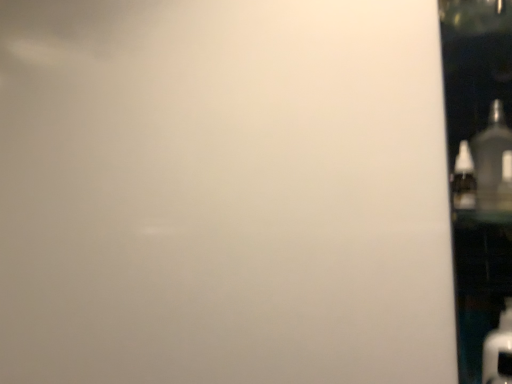
What do you see at coordinates (480, 181) in the screenshot? The image size is (512, 384). I see `transparent glass door at right` at bounding box center [480, 181].

The height and width of the screenshot is (384, 512). What are the coordinates of `transparent glass door at right` in the screenshot? It's located at (480, 181).

Is clear plastic bottle at right, which is counted as the 2th bottle, starting from the right, aimed at transparent glass door at right?

Yes, clear plastic bottle at right, which is counted as the 2th bottle, starting from the right, is facing transparent glass door at right.

Between point (456, 201) and point (488, 294), which one is positioned in front?

The point (456, 201) is more forward.

Considering the positions of objects clear plastic bottle at right, the 1th bottle from the left, and transparent glass door at right in the image provided, who is in front, clear plastic bottle at right, the 1th bottle from the left, or transparent glass door at right?

transparent glass door at right.

Can you confirm if clear plastic bottle at right, which is counted as the 2th bottle, starting from the right, is positioned to the left of transparent glass door at right?

Yes.

Locate an element on the screen. bottle that is the 1st object above the transparent glass door at right (from a real-world perspective) is located at coordinates (463, 179).

Is transparent glass door at right bigger or smaller than clear plastic bottle at right, which is counted as the 2th bottle, starting from the right?

Considering their sizes, transparent glass door at right takes up more space than clear plastic bottle at right, which is counted as the 2th bottle, starting from the right.

Consider the image. From the image's perspective, relative to clear plastic bottle at right, the 1th bottle from the left, is transparent glass door at right above or below?

Based on their image positions, transparent glass door at right is located beneath clear plastic bottle at right, the 1th bottle from the left.

Is transparent glass door at right next to clear plastic bottle at right, which is counted as the 2th bottle, starting from the right?

They are not placed beside each other.

From a real-world perspective, relative to clear plastic bottle at right, which is counted as the 2th bottle, starting from the right, is matte black bottle at right, the 2th bottle viewed from the left, vertically above or below?

From a real-world perspective, matte black bottle at right, the 2th bottle viewed from the left, is physically above clear plastic bottle at right, which is counted as the 2th bottle, starting from the right.

Could you measure the distance between matte black bottle at right, the 2th bottle viewed from the left, and clear plastic bottle at right, which is counted as the 2th bottle, starting from the right?

The distance of matte black bottle at right, the 2th bottle viewed from the left, from clear plastic bottle at right, which is counted as the 2th bottle, starting from the right, is 1.37 inches.

Considering the sizes of objects matte black bottle at right, the 2th bottle viewed from the left, and clear plastic bottle at right, the 1th bottle from the left, in the image provided, who is smaller, matte black bottle at right, the 2th bottle viewed from the left, or clear plastic bottle at right, the 1th bottle from the left,?

clear plastic bottle at right, the 1th bottle from the left.

Is matte black bottle at right, the 2th bottle viewed from the left, not close to clear plastic bottle at right, the 1th bottle from the left?

No, matte black bottle at right, the 2th bottle viewed from the left, is not far from clear plastic bottle at right, the 1th bottle from the left.

From the image's perspective, is clear plastic bottle at right, which is counted as the 2th bottle, starting from the right, under matte black bottle at right, the 2th bottle viewed from the left?

Correct, clear plastic bottle at right, which is counted as the 2th bottle, starting from the right, appears lower than matte black bottle at right, the 2th bottle viewed from the left, in the image.

Looking at this image, is clear plastic bottle at right, the 1th bottle from the left, not close to matte black bottle at right, the 2th bottle viewed from the left?

That's not correct — clear plastic bottle at right, the 1th bottle from the left, is a little close to matte black bottle at right, the 2th bottle viewed from the left.

Considering their positions, is clear plastic bottle at right, the 1th bottle from the left, located in front of or behind matte black bottle at right, placed as the 1th bottle when sorted from right to left?

clear plastic bottle at right, the 1th bottle from the left, is behind matte black bottle at right, placed as the 1th bottle when sorted from right to left.

Can you confirm if clear plastic bottle at right, which is counted as the 2th bottle, starting from the right, is smaller than matte black bottle at right, the 2th bottle viewed from the left?

Yes.

Is transparent glass door at right looking in the opposite direction of matte black bottle at right, the 2th bottle viewed from the left?

That's right, transparent glass door at right is facing away from matte black bottle at right, the 2th bottle viewed from the left.

Can we say transparent glass door at right lies outside matte black bottle at right, the 2th bottle viewed from the left?

Yes, transparent glass door at right is not within matte black bottle at right, the 2th bottle viewed from the left.

Is transparent glass door at right with matte black bottle at right, placed as the 1th bottle when sorted from right to left?

They are not placed beside each other.

Based on their positions, is matte black bottle at right, the 2th bottle viewed from the left, located to the left or right of transparent glass door at right?

matte black bottle at right, the 2th bottle viewed from the left, is to the left of transparent glass door at right.

Is matte black bottle at right, placed as the 1th bottle when sorted from right to left, not near transparent glass door at right?

They are positioned close to each other.

From the image's perspective, which object appears higher, matte black bottle at right, the 2th bottle viewed from the left, or transparent glass door at right?

From the image's view, matte black bottle at right, the 2th bottle viewed from the left, is above.

From a real-world perspective, is matte black bottle at right, the 2th bottle viewed from the left, located higher than transparent glass door at right?

Yes, from a real-world perspective, matte black bottle at right, the 2th bottle viewed from the left, is over transparent glass door at right

This screenshot has width=512, height=384. Find the location of `glass door that is below the clear plastic bottle at right, the 1th bottle from the left (from the image's perspective)`. glass door that is below the clear plastic bottle at right, the 1th bottle from the left (from the image's perspective) is located at coordinates (480, 181).

From a real-world perspective, starting from the transparent glass door at right, which bottle is the 1st one vertically above it? Please provide its 2D coordinates.

[(463, 179)]

Which object lies nearer to the anchor point transparent glass door at right, matte black bottle at right, placed as the 1th bottle when sorted from right to left, or clear plastic bottle at right, which is counted as the 2th bottle, starting from the right?

Among the two, matte black bottle at right, placed as the 1th bottle when sorted from right to left, is located nearer to transparent glass door at right.

When comparing their distances from clear plastic bottle at right, the 1th bottle from the left, does matte black bottle at right, the 2th bottle viewed from the left, or transparent glass door at right seem further?

transparent glass door at right.

Consider the image. From the image, which object appears to be nearer to matte black bottle at right, the 2th bottle viewed from the left, clear plastic bottle at right, which is counted as the 2th bottle, starting from the right, or transparent glass door at right?

The object closer to matte black bottle at right, the 2th bottle viewed from the left, is clear plastic bottle at right, which is counted as the 2th bottle, starting from the right.

Looking at the image, which one is located closer to clear plastic bottle at right, which is counted as the 2th bottle, starting from the right, transparent glass door at right or matte black bottle at right, placed as the 1th bottle when sorted from right to left?

matte black bottle at right, placed as the 1th bottle when sorted from right to left, lies closer to clear plastic bottle at right, which is counted as the 2th bottle, starting from the right, than the other object.

Based on their spatial positions, is transparent glass door at right or clear plastic bottle at right, the 1th bottle from the left, closer to matte black bottle at right, placed as the 1th bottle when sorted from right to left?

clear plastic bottle at right, the 1th bottle from the left, is positioned closer to the anchor matte black bottle at right, placed as the 1th bottle when sorted from right to left.

From the image, which object appears to be nearer to transparent glass door at right, clear plastic bottle at right, the 1th bottle from the left, or matte black bottle at right, placed as the 1th bottle when sorted from right to left?

Among the two, matte black bottle at right, placed as the 1th bottle when sorted from right to left, is located nearer to transparent glass door at right.

Identify the location of bottle between transparent glass door at right and clear plastic bottle at right, the 1th bottle from the left, from front to back. Image resolution: width=512 pixels, height=384 pixels. (493, 162).